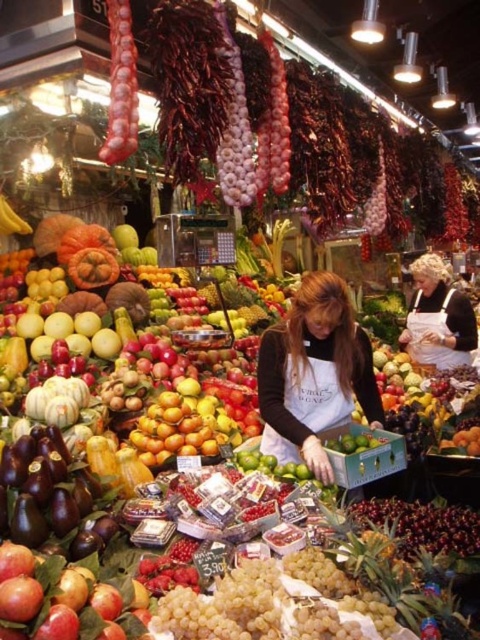
Question: Which point is farther to the camera?

Choices:
 (A) black matte apron at center
 (B) shiny golden oranges at center
 (C) matte black apron at center

Answer: (A)

Question: Which object appears farthest from the camera in this image?

Choices:
 (A) black matte apron at center
 (B) shiny golden oranges at center
 (C) matte black apron at center

Answer: (A)

Question: Estimate the real-world distances between objects in this image. Which object is farther from the black matte apron at center?

Choices:
 (A) shiny golden oranges at center
 (B) matte black apron at center

Answer: (A)

Question: Is black matte apron at center behind shiny golden oranges at center?

Choices:
 (A) no
 (B) yes

Answer: (B)

Question: Does black matte apron at center have a greater width compared to shiny golden oranges at center?

Choices:
 (A) yes
 (B) no

Answer: (A)

Question: Can you confirm if black matte apron at center is thinner than shiny golden oranges at center?

Choices:
 (A) yes
 (B) no

Answer: (B)